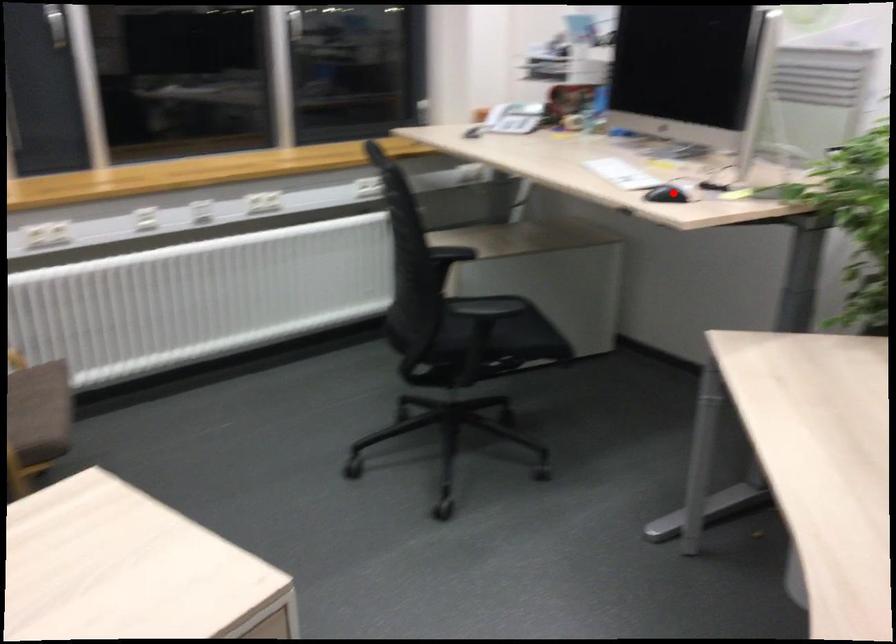
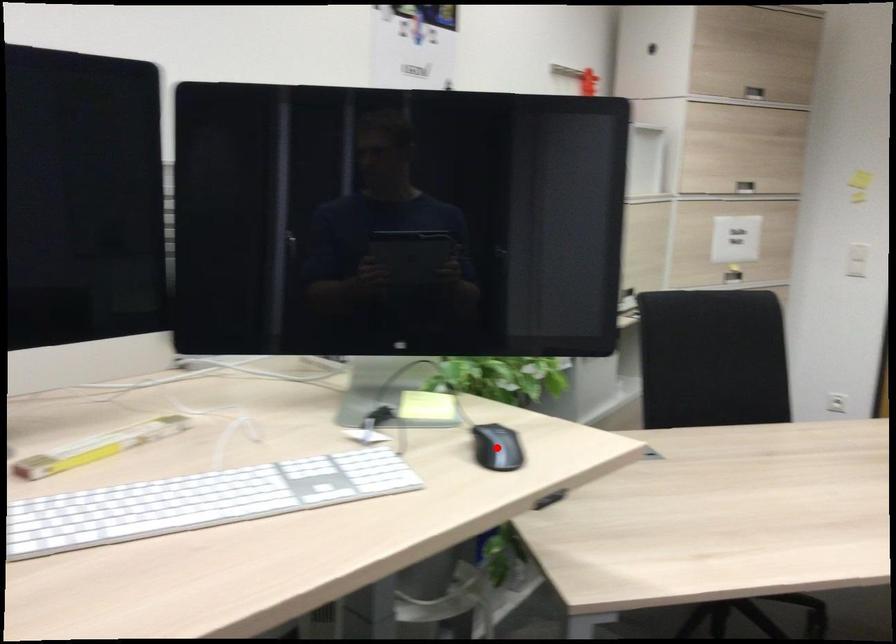
I am providing you with two images of the same scene from different viewpoints. A red point is marked on the first image and another point is marked on the second image. Is the marked point in image1 the same physical position as the marked point in image2?

Yes